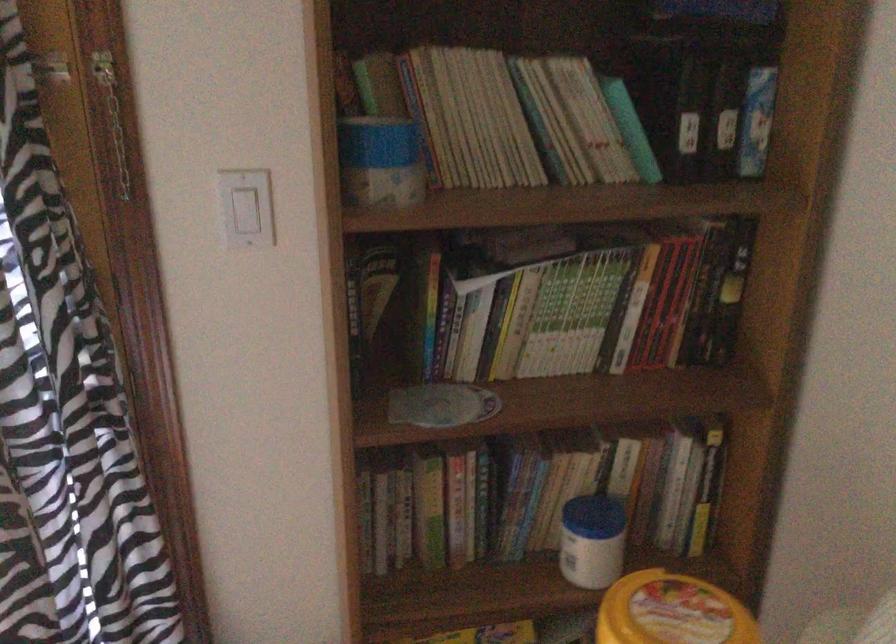
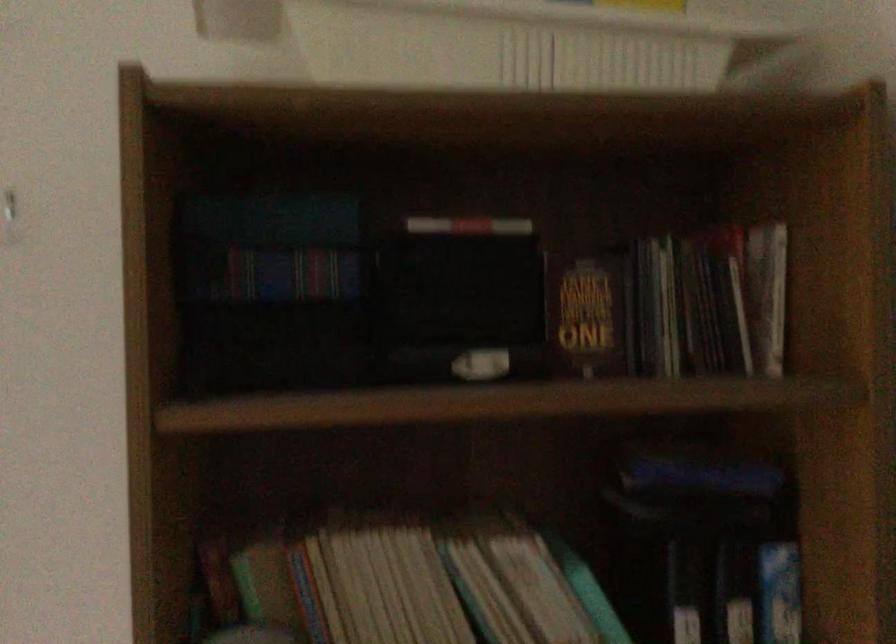
Question: Based on the continuous images, in which direction is the camera rotating? Reply with the corresponding letter.

Choices:
 (A) Left
 (B) Right
 (C) Up
 (D) Down

Answer: (C)